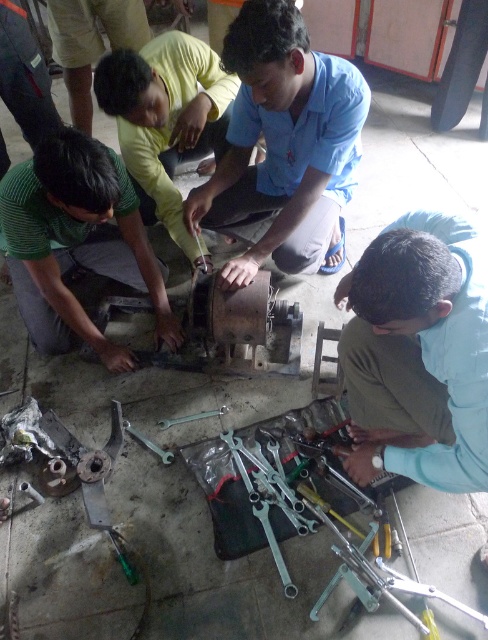
Is light blue shirt at lower right closer to the viewer compared to green matte metal tool at lower left?

Yes, light blue shirt at lower right is closer to the viewer.

Consider the image. Does light blue shirt at lower right appear over green matte metal tool at lower left?

No.

Is point (482, 477) farther from camera compared to point (38, 316)?

No, (482, 477) is closer to viewer.

At what (x,y) coordinates should I click in order to perform the action: click on light blue shirt at lower right. Please return your answer as a coordinate pair (x, y). The width and height of the screenshot is (488, 640). Looking at the image, I should click on (425, 346).

Is blue cotton shirt at center shorter than yellow matte shirt at center?

Correct, blue cotton shirt at center is not as tall as yellow matte shirt at center.

Who is more distant from viewer, (285, 253) or (165, 93)?

The point (285, 253) is behind.

Where is `blue cotton shirt at center`? This screenshot has width=488, height=640. blue cotton shirt at center is located at coordinates tap(284, 141).

Is blue cotton shirt at center shorter than green matte metal tool at lower left?

Yes, blue cotton shirt at center is shorter than green matte metal tool at lower left.

Measure the distance from blue cotton shirt at center to green matte metal tool at lower left.

A distance of 21.24 inches exists between blue cotton shirt at center and green matte metal tool at lower left.

Identify the location of blue cotton shirt at center. (284, 141).